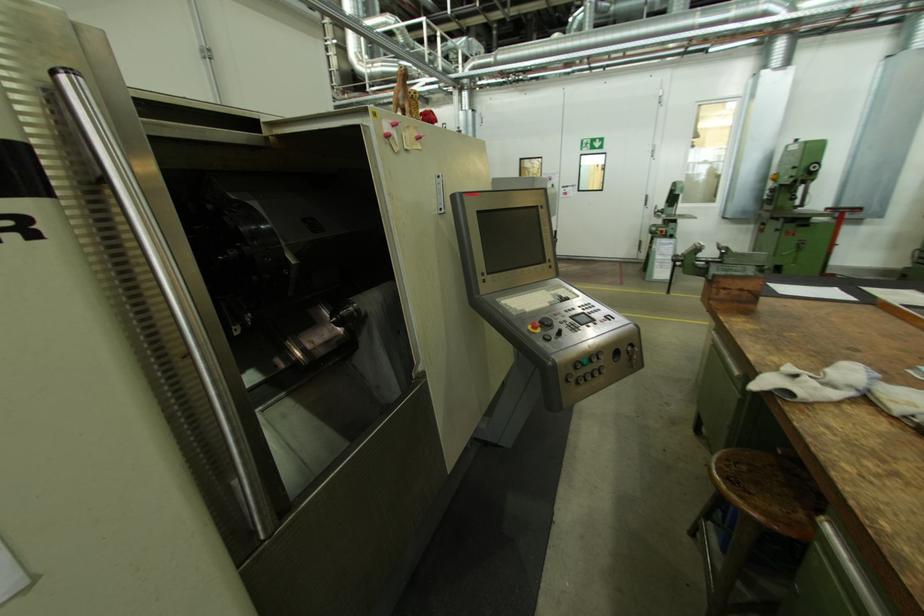
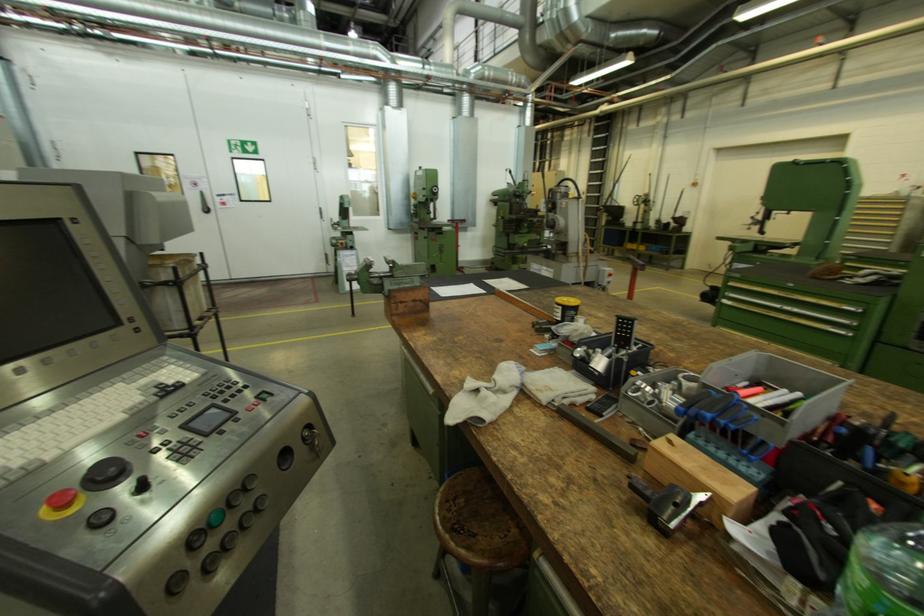
Question: The first image is from the beginning of the video and the second image is from the end. How did the camera likely rotate when shooting the video?

Choices:
 (A) Left
 (B) Right
 (C) Up
 (D) Down

Answer: (B)